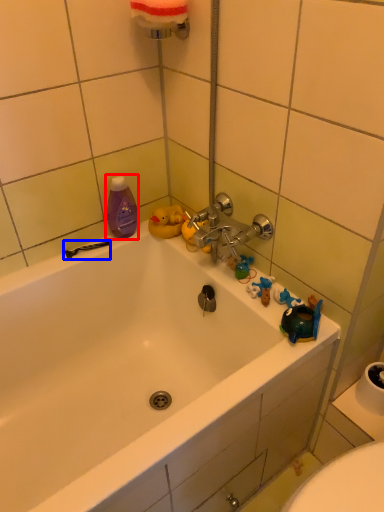
Question: Which object is further to the camera taking this photo, mouthwash (highlighted by a red box) or shower (highlighted by a blue box)?

Choices:
 (A) mouthwash
 (B) shower

Answer: (B)